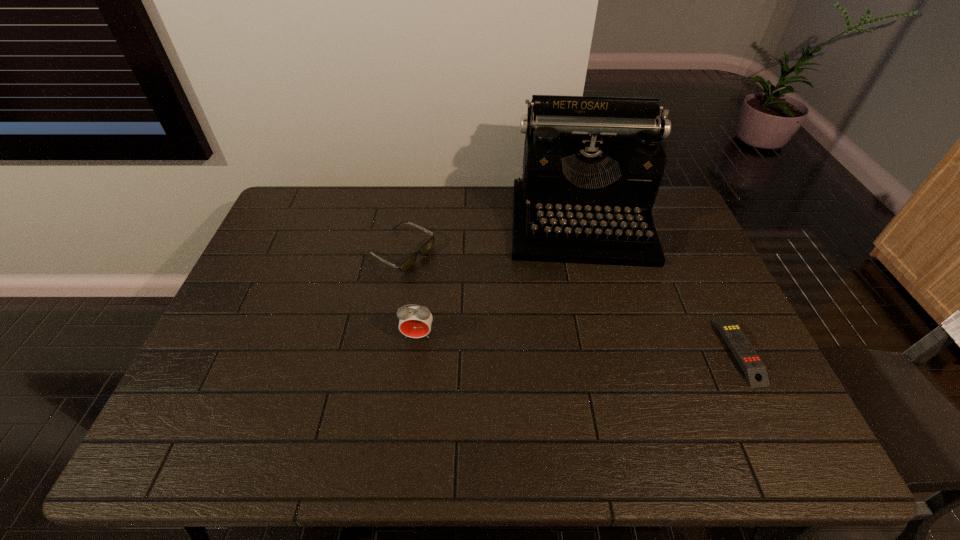
The image size is (960, 540). Identify the location of alarm clock. (415, 321).

Identify the location of remote control. The height and width of the screenshot is (540, 960). (754, 369).

At what (x,y) coordinates should I click in order to perform the action: click on the rightmost object. Please return your answer as a coordinate pair (x, y). Looking at the image, I should click on pos(754,369).

At what (x,y) coordinates should I click in order to perform the action: click on the second shortest object. Please return your answer as a coordinate pair (x, y). Image resolution: width=960 pixels, height=540 pixels. Looking at the image, I should click on (409, 261).

Image resolution: width=960 pixels, height=540 pixels. Identify the location of the tallest object. (592, 167).

Identify the location of the third object from left to right. This screenshot has height=540, width=960. (592, 167).

Image resolution: width=960 pixels, height=540 pixels. Identify the location of vacant space located 0.170m on the face of the third shortest object. (410, 402).

Where is `free space located on the left of the rightmost object`? free space located on the left of the rightmost object is located at coordinates (576, 351).

This screenshot has width=960, height=540. Identify the location of vacant region located on the front-facing side of the third tallest object. (484, 294).

This screenshot has width=960, height=540. In order to click on vacant position located 0.130m on the front-facing side of the third tallest object in this screenshot , I will do `click(462, 283)`.